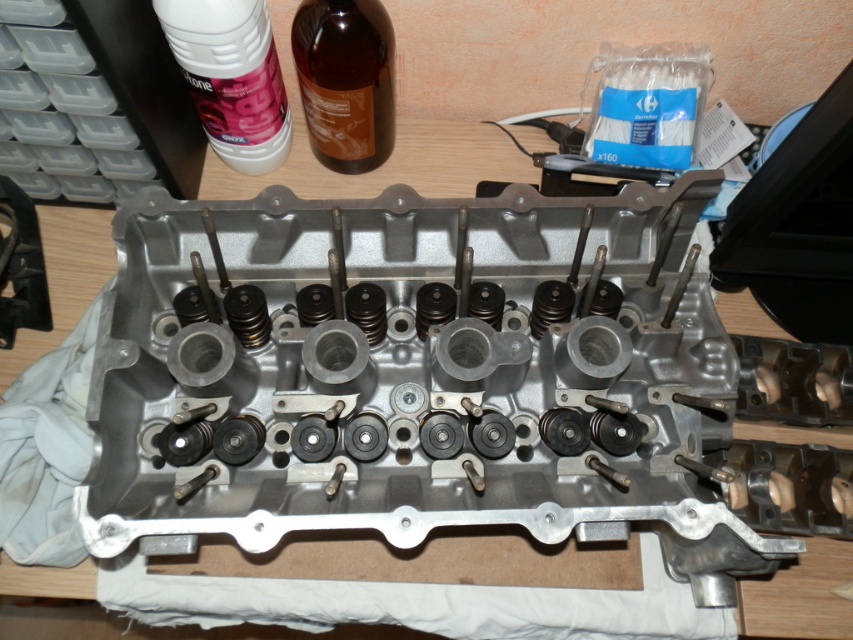
You are an engineer working on assembling the engine cylinder head. You need to place the white plastic bottle at upper left and the brown glass bottle at upper center onto a shelf that is 4 inches wide. Can both bottles fit side by side on the shelf without overlapping?

The distance between the white plastic bottle at upper left and brown glass bottle at upper center is 3.52 inches. Since the shelf is 4 inches wide, both bottles can fit side by side as the total required space is less than the shelf width.

You are an engineer inspecting the engine cylinder head. You notice two points marked on the cylinder head at coordinates point (x=260, y=145) and point (x=337, y=164). From your viewpoint, which point is closer to you?

Point (x=260, y=145) is in front of point (x=337, y=164), so the point (x=260, y=145) is closer to you.